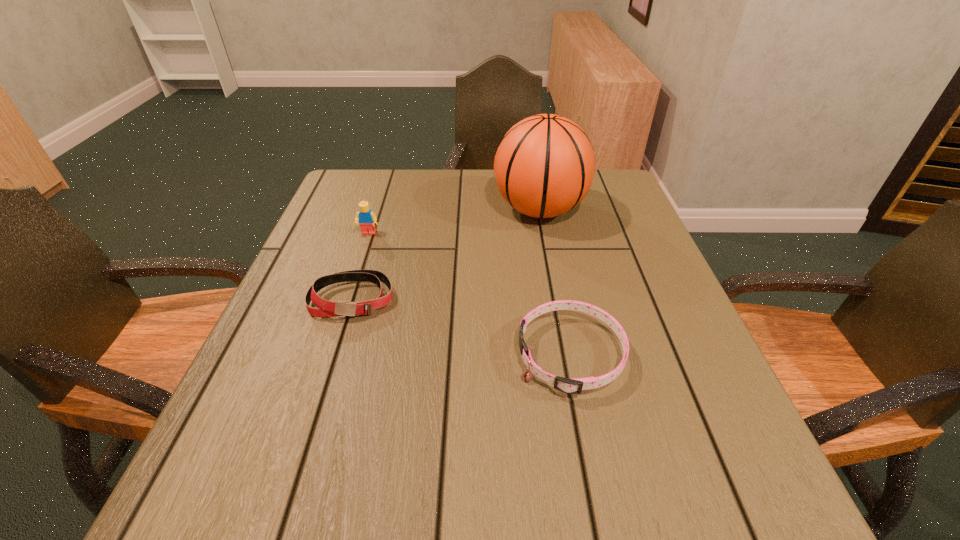
Where is `free region at the far right corner of the desktop`? The height and width of the screenshot is (540, 960). free region at the far right corner of the desktop is located at coordinates (628, 207).

This screenshot has width=960, height=540. In order to click on free space between the right dog collar and the basketball in this screenshot , I will do `click(555, 282)`.

Where is `free spot between the tallest object and the second tallest object`? The image size is (960, 540). free spot between the tallest object and the second tallest object is located at coordinates (454, 222).

Locate an element on the screen. The width and height of the screenshot is (960, 540). free space between the basketball and the right dog collar is located at coordinates (555, 282).

The width and height of the screenshot is (960, 540). I want to click on vacant space that is in between the basketball and the right dog collar, so click(555, 282).

This screenshot has height=540, width=960. Identify the location of free spot between the basketball and the right dog collar. (555, 282).

The height and width of the screenshot is (540, 960). Identify the location of empty space between the tallest object and the right dog collar. (555, 282).

Locate an element on the screen. The height and width of the screenshot is (540, 960). free space that is in between the Lego and the right dog collar is located at coordinates (469, 294).

Where is `free point between the Lego and the basketball`? This screenshot has width=960, height=540. free point between the Lego and the basketball is located at coordinates (454, 222).

At what (x,y) coordinates should I click in order to perform the action: click on free space between the right dog collar and the tallest object. Please return your answer as a coordinate pair (x, y). The height and width of the screenshot is (540, 960). Looking at the image, I should click on (555, 282).